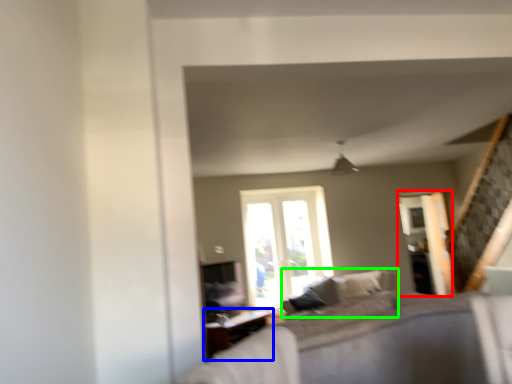
Question: Based on their relative distances, which object is nearer to screen door (highlighted by a red box)? Choose from table (highlighted by a blue box) and couch (highlighted by a green box).

Choices:
 (A) table
 (B) couch

Answer: (B)